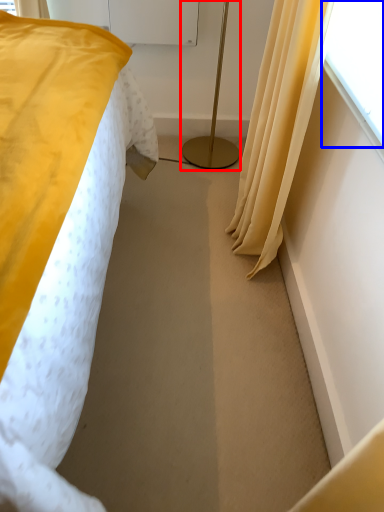
Question: Which of the following is the closest to the observer, bedside lamp (highlighted by a red box) or window screen (highlighted by a blue box)?

Choices:
 (A) bedside lamp
 (B) window screen

Answer: (B)